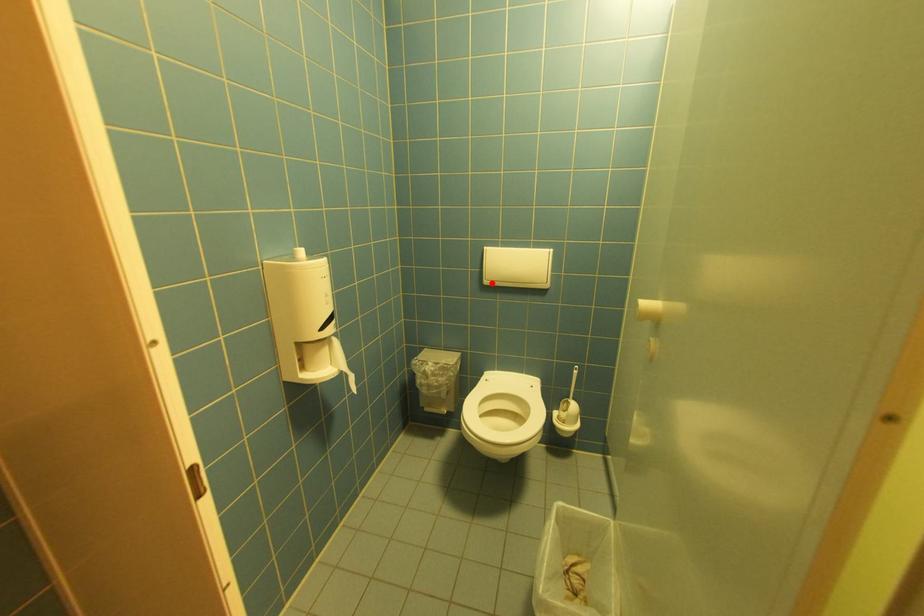
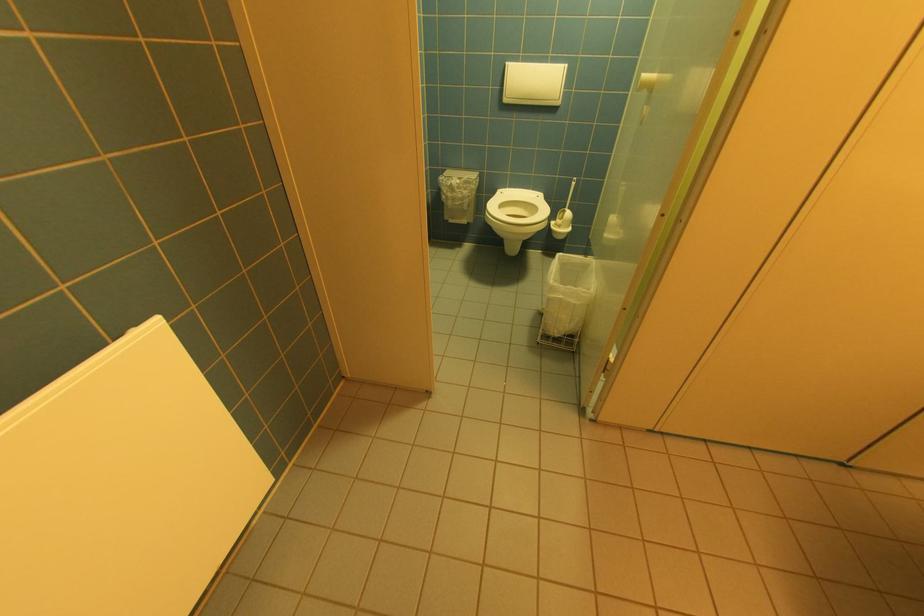
Locate, in the second image, the point that corresponds to the highlighted location in the first image.

(512, 100)